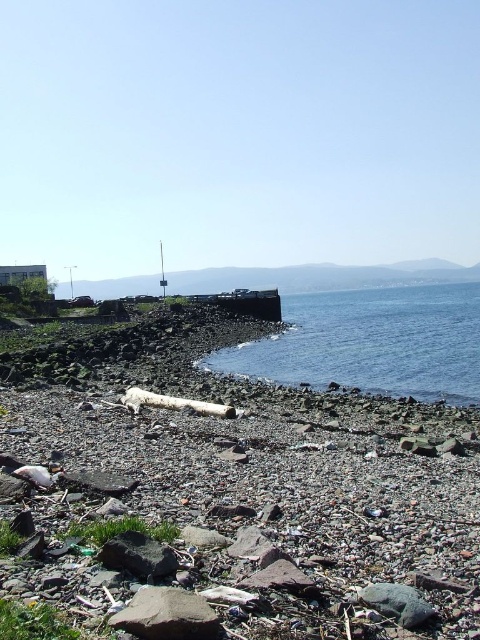
Can you confirm if rough stone beach at lower left is positioned below blue water at center?

Indeed, rough stone beach at lower left is positioned under blue water at center.

Is rough stone beach at lower left wider than blue water at center?

In fact, rough stone beach at lower left might be narrower than blue water at center.

Who is more forward, (253, 618) or (374, 385)?

Point (253, 618) is in front.

The image size is (480, 640). In order to click on rough stone beach at lower left in this screenshot , I will do `click(233, 490)`.

Is gray rough rock at lower center positioned at the back of dark gray rock at lower center?

No, it is in front of dark gray rock at lower center.

Based on the photo, between gray rough rock at lower center and dark gray rock at lower center, which one is positioned higher?

dark gray rock at lower center

This screenshot has width=480, height=640. Describe the element at coordinates (167, 614) in the screenshot. I see `gray rough rock at lower center` at that location.

Where is `gray rough rock at lower center`? This screenshot has width=480, height=640. gray rough rock at lower center is located at coordinates (167, 614).

Is rough stone beach at lower left further to the viewer compared to dark gray rock at lower center?

No, it is not.

Who is more forward, (232, 632) or (144, 534)?

Point (232, 632) is more forward.

Who is more distant from viewer, (411, 554) or (163, 573)?

Positioned behind is point (411, 554).

You are a GUI agent. You are given a task and a screenshot of the screen. Output one action in this format:
    pyautogui.click(x=<x>, y=<y>)
    Task: Click on the rough stone beach at lower left
    
    Given the screenshot: What is the action you would take?
    pyautogui.click(x=233, y=490)